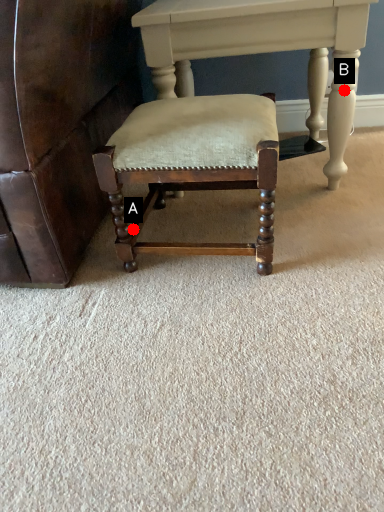
Question: Two points are circled on the image, labeled by A and B beside each circle. Among these points, which one is farthest from the camera?

Choices:
 (A) A is further
 (B) B is further

Answer: (A)